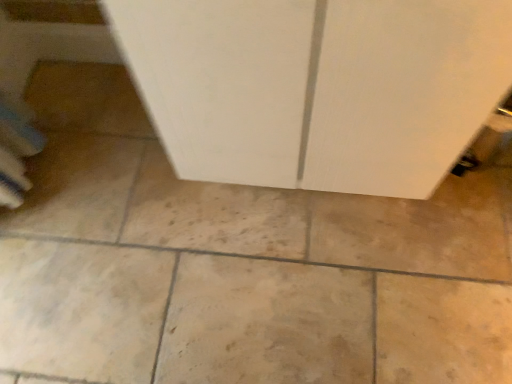
Locate an element on the screen. Image resolution: width=512 pixels, height=384 pixels. vacant area that is in front of white matte cabinet at center is located at coordinates (321, 291).